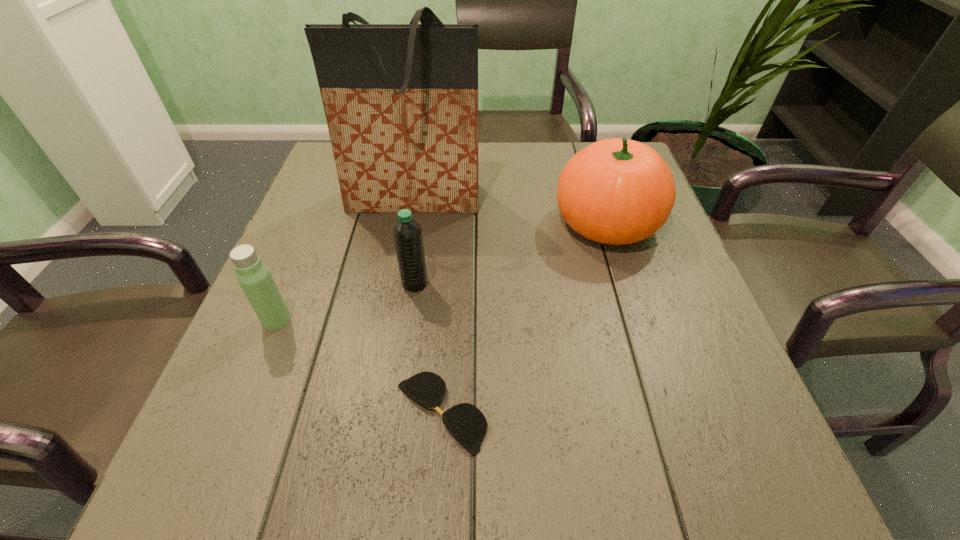
This screenshot has height=540, width=960. I want to click on free space that satisfies the following two spatial constraints: 1. on the front-facing side of the spectacles; 2. on the right side of the shopping bag, so (377, 412).

This screenshot has height=540, width=960. Identify the location of free spot that satisfies the following two spatial constraints: 1. on the back side of the thermos bottle; 2. on the right side of the second tallest object. (316, 222).

This screenshot has width=960, height=540. Identify the location of free space that satisfies the following two spatial constraints: 1. on the front-facing side of the third nearest object; 2. on the left side of the shopping bag. (399, 284).

Locate an element on the screen. free spot that satisfies the following two spatial constraints: 1. on the back side of the third farthest object; 2. on the right side of the pumpkin is located at coordinates (423, 222).